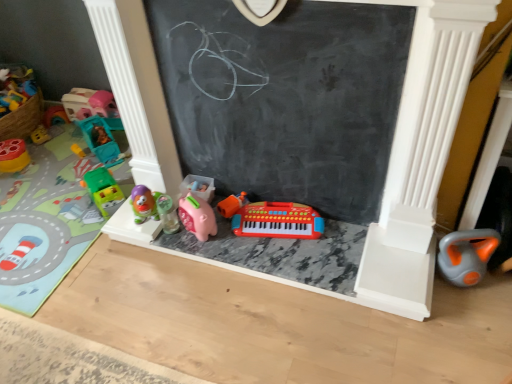
I want to click on vacant area located to the right-hand side of pink rubber piggy bank at center, which is the 2th toy in right-to-left order, so click(238, 238).